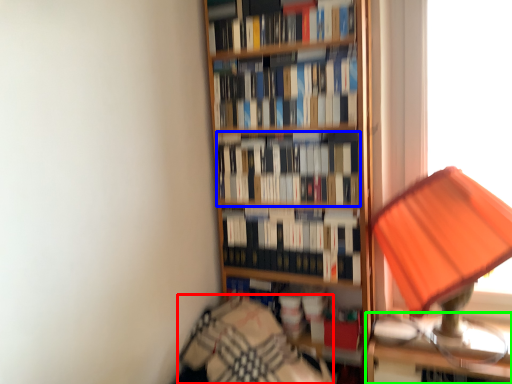
Question: Estimate the real-world distances between objects in this image. Which object is closer to bedding (highlighted by a red box), book (highlighted by a blue box) or table (highlighted by a green box)?

Choices:
 (A) book
 (B) table

Answer: (B)